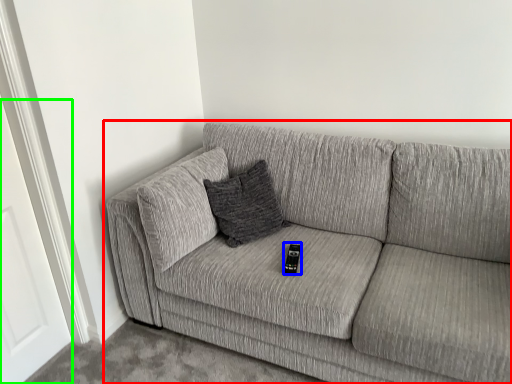
Question: Considering the real-world distances, which object is closest to studio couch (highlighted by a red box)? remote (highlighted by a blue box) or door (highlighted by a green box).

Choices:
 (A) remote
 (B) door

Answer: (A)